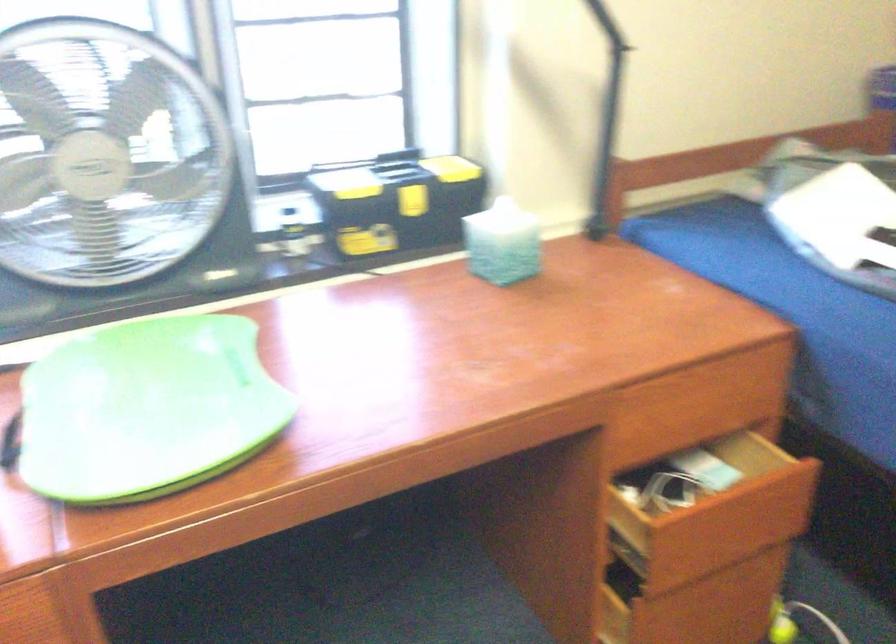
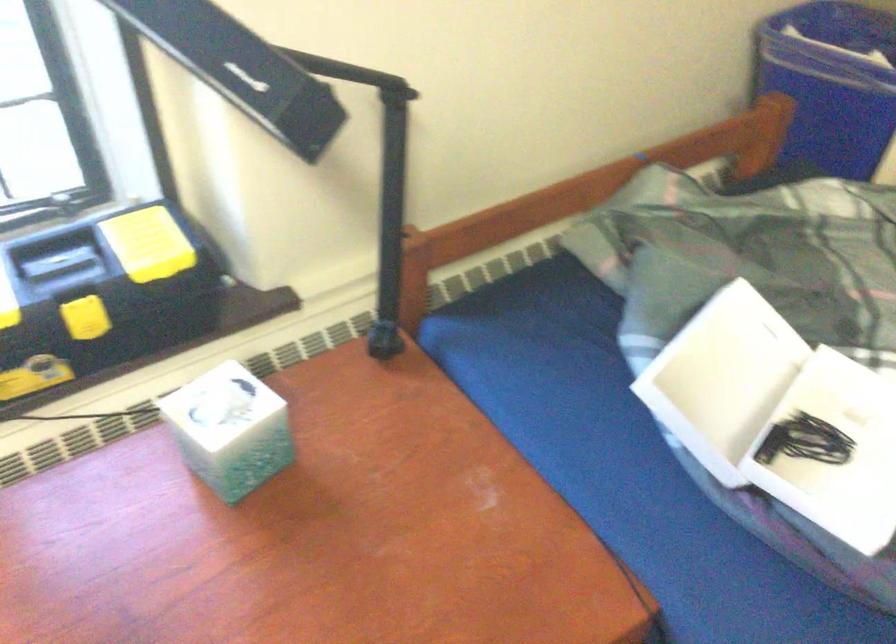
Locate, in the second image, the point that corresponds to [409,192] in the first image.

(83, 314)